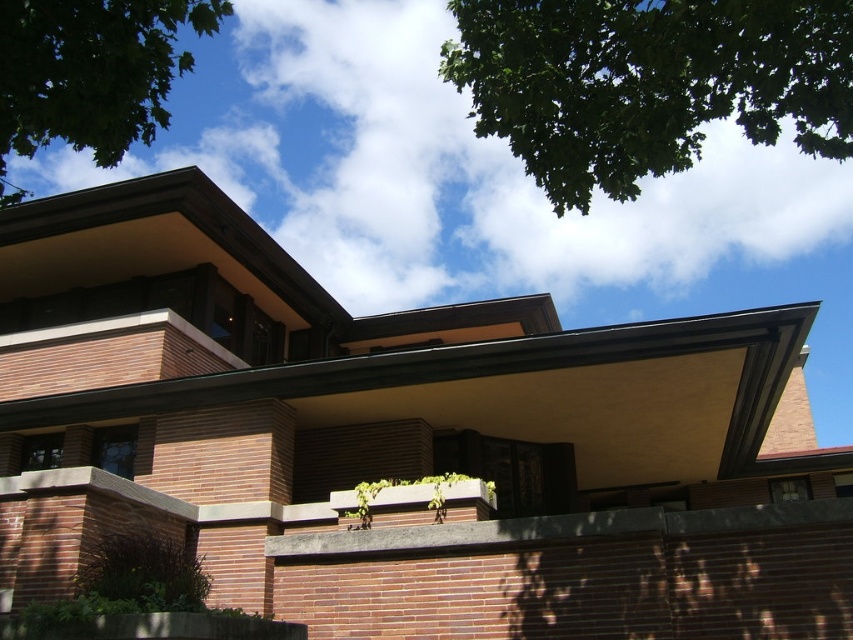
Is green leafy tree at upper center bigger than green leafy tree at upper left?

Actually, green leafy tree at upper center might be smaller than green leafy tree at upper left.

The image size is (853, 640). Describe the element at coordinates (647, 83) in the screenshot. I see `green leafy tree at upper center` at that location.

Is point (763, 93) farther from viewer compared to point (85, 48)?

Yes.

At what (x,y) coordinates should I click in order to perform the action: click on green leafy tree at upper center. Please return your answer as a coordinate pair (x, y). The image size is (853, 640). Looking at the image, I should click on (647, 83).